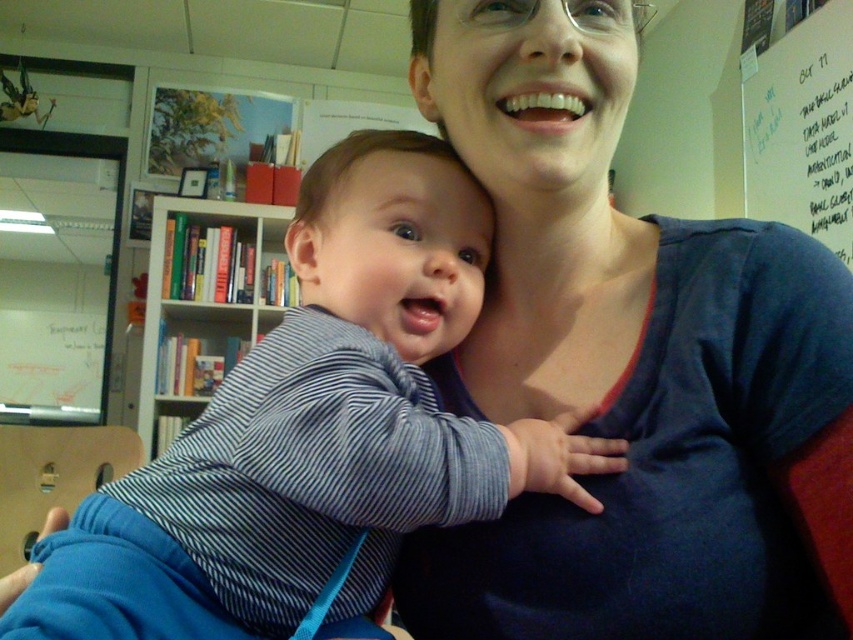
You are a student entering the classroom and need to write on the white dry erase board at upper right and reach the hardcover books at left. Which object will you reach first?

You will reach the white dry erase board at upper right first because it is closer to you than the hardcover books at left.

You are an interior designer analyzing the layout of the room in the image. Which object is positioned to the right side of the other between the blue cotton shirt at center and the hardcover books at left?

The blue cotton shirt at center is positioned to the right of the hardcover books at left.